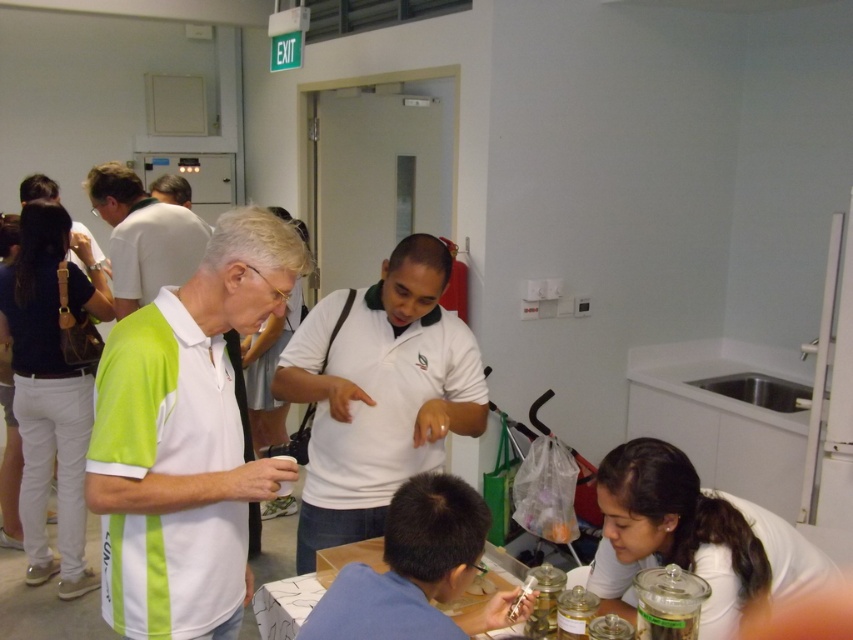
Question: Observing the image, what is the correct spatial positioning of white matte shirt at center in reference to blue fabric shirt at lower center?

Choices:
 (A) below
 (B) above

Answer: (B)

Question: Among these points, which one is nearest to the camera?

Choices:
 (A) (445, 576)
 (B) (374, 566)
 (C) (397, 253)

Answer: (A)

Question: Which object is closer to the camera taking this photo?

Choices:
 (A) white matte polo shirt at upper left
 (B) white glossy table at lower center

Answer: (B)

Question: Does white matte shirt at center have a lesser width compared to white matte polo shirt at upper left?

Choices:
 (A) no
 (B) yes

Answer: (A)

Question: Is white matte polo shirt at center below white matte polo shirt at upper left?

Choices:
 (A) yes
 (B) no

Answer: (A)

Question: Which point appears closest to the camera in this image?

Choices:
 (A) (421, 451)
 (B) (134, 260)

Answer: (A)